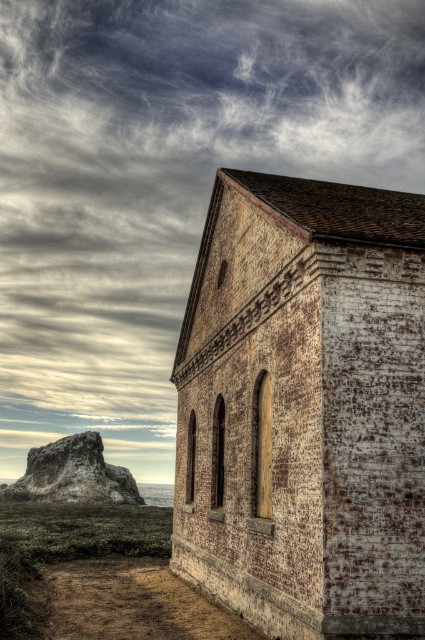
Question: Which point appears closest to the camera in this image?

Choices:
 (A) coord(323,212)
 (B) coord(59,458)

Answer: (A)

Question: Can you confirm if rustic brick church at center is positioned above rustic stone rock at left?

Choices:
 (A) no
 (B) yes

Answer: (B)

Question: Where is rustic brick church at center located in relation to rustic stone rock at left in the image?

Choices:
 (A) left
 (B) right

Answer: (B)

Question: Which of the following is the farthest from the observer?

Choices:
 (A) (79, 454)
 (B) (289, 337)

Answer: (A)

Question: Is rustic brick church at center above rustic stone rock at left?

Choices:
 (A) no
 (B) yes

Answer: (B)